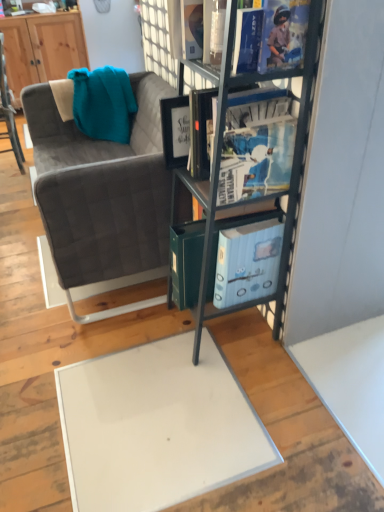
Question: Can you confirm if wooden cabinet at upper left is positioned to the left of velvet grey couch at left?

Choices:
 (A) yes
 (B) no

Answer: (A)

Question: Does wooden cabinet at upper left contain velvet grey couch at left?

Choices:
 (A) no
 (B) yes

Answer: (A)

Question: Is wooden cabinet at upper left thinner than velvet grey couch at left?

Choices:
 (A) no
 (B) yes

Answer: (B)

Question: Does wooden cabinet at upper left have a smaller size compared to velvet grey couch at left?

Choices:
 (A) yes
 (B) no

Answer: (A)

Question: Considering the relative sizes of wooden cabinet at upper left and velvet grey couch at left in the image provided, is wooden cabinet at upper left wider than velvet grey couch at left?

Choices:
 (A) no
 (B) yes

Answer: (A)

Question: Is velvet grey chair at left taller or shorter than metallic gray bookshelf at center?

Choices:
 (A) tall
 (B) short

Answer: (B)

Question: From the image's perspective, is velvet grey chair at left positioned above or below metallic gray bookshelf at center?

Choices:
 (A) below
 (B) above

Answer: (B)

Question: Which is correct: velvet grey chair at left is inside metallic gray bookshelf at center, or outside of it?

Choices:
 (A) inside
 (B) outside

Answer: (B)

Question: In terms of size, does velvet grey chair at left appear bigger or smaller than metallic gray bookshelf at center?

Choices:
 (A) small
 (B) big

Answer: (A)

Question: Considering the relative positions of velvet grey chair at left and wooden cabinet at upper left in the image provided, is velvet grey chair at left to the left or to the right of wooden cabinet at upper left?

Choices:
 (A) right
 (B) left

Answer: (A)

Question: Is point (x=1, y=35) positioned closer to the camera than point (x=77, y=39)?

Choices:
 (A) farther
 (B) closer

Answer: (B)

Question: From the image's perspective, is velvet grey chair at left positioned above or below wooden cabinet at upper left?

Choices:
 (A) above
 (B) below

Answer: (B)

Question: Considering their positions, is velvet grey chair at left located in front of or behind wooden cabinet at upper left?

Choices:
 (A) front
 (B) behind

Answer: (A)

Question: From a real-world perspective, relative to blue glossy book at upper center, is metallic gray bookshelf at center vertically above or below?

Choices:
 (A) below
 (B) above

Answer: (A)

Question: In the image, is metallic gray bookshelf at center positioned in front of or behind blue glossy book at upper center?

Choices:
 (A) behind
 (B) front

Answer: (B)